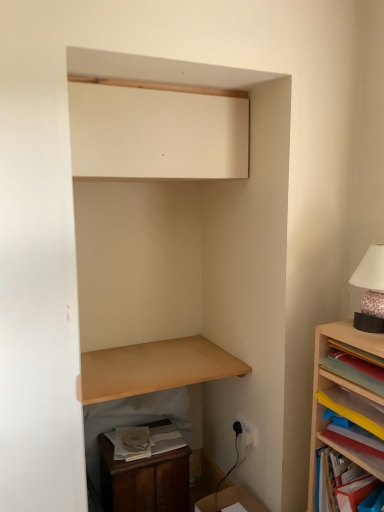
You are a GUI agent. You are given a task and a screenshot of the screen. Output one action in this format:
    pyautogui.click(x=<x>, y=<y>)
    Task: Click on the vacant area situated below matte white cabinet at upper center (from a real-world perspective)
    The height and width of the screenshot is (512, 384).
    Given the screenshot: What is the action you would take?
    pyautogui.click(x=158, y=357)